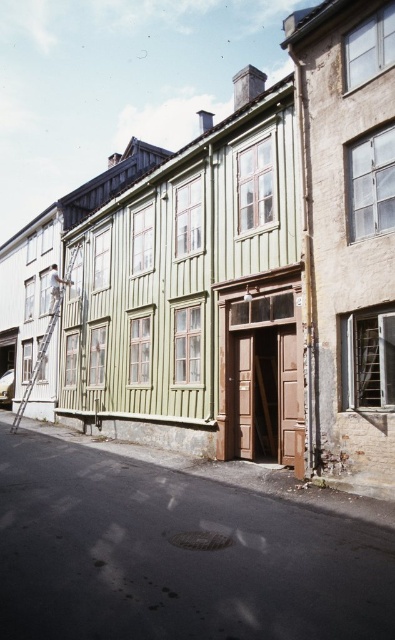
Is metallic silver ladder at left bigger than light brown wooden ladder at upper left?

Correct, metallic silver ladder at left is larger in size than light brown wooden ladder at upper left.

Does metallic silver ladder at left have a lesser height compared to light brown wooden ladder at upper left?

No.

Is point (77, 250) less distant than point (62, 284)?

Yes.

You are a GUI agent. You are given a task and a screenshot of the screen. Output one action in this format:
    pyautogui.click(x=<x>, y=<y>)
    Task: Click on the metallic silver ladder at left
    This screenshot has height=640, width=395.
    Given the screenshot: What is the action you would take?
    (x=37, y=364)